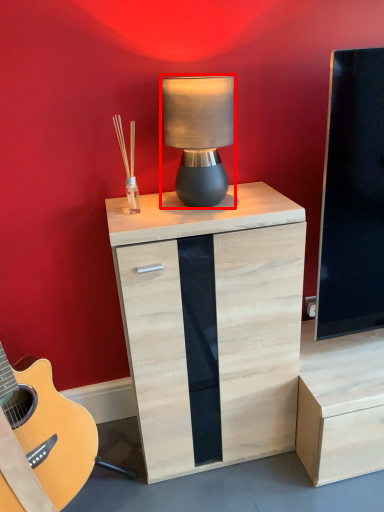
Question: From the image's perspective, where is lamp (annotated by the red box) located in relation to chest of drawers in the image?

Choices:
 (A) below
 (B) above

Answer: (B)